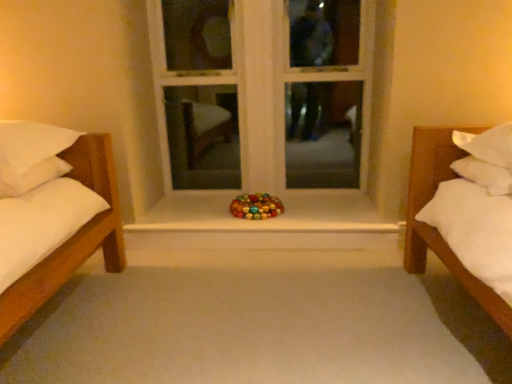
Question: From the image's perspective, relative to smooth white surface at center, is white wood window frame at center above or below?

Choices:
 (A) below
 (B) above

Answer: (B)

Question: In terms of width, does white wood window frame at center look wider or thinner when compared to smooth white surface at center?

Choices:
 (A) wide
 (B) thin

Answer: (B)

Question: Based on their relative distances, which object is nearer to the smooth white surface at center?

Choices:
 (A) glossy plastic toy at center
 (B) white soft pillow at left
 (C) white wood window frame at center

Answer: (A)

Question: Based on their relative distances, which object is farther from the white soft pillow at left?

Choices:
 (A) glossy plastic toy at center
 (B) smooth white surface at center
 (C) white wood window frame at center

Answer: (C)